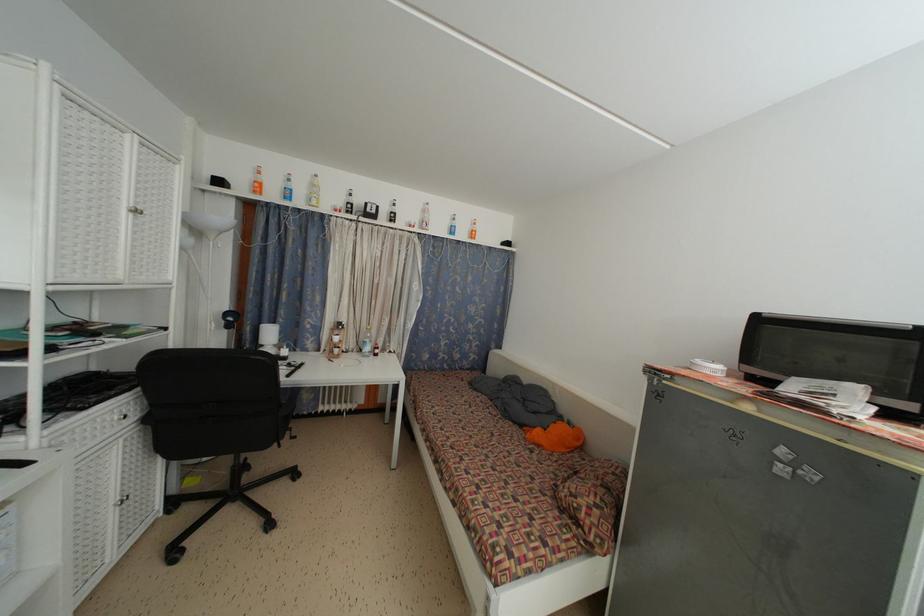
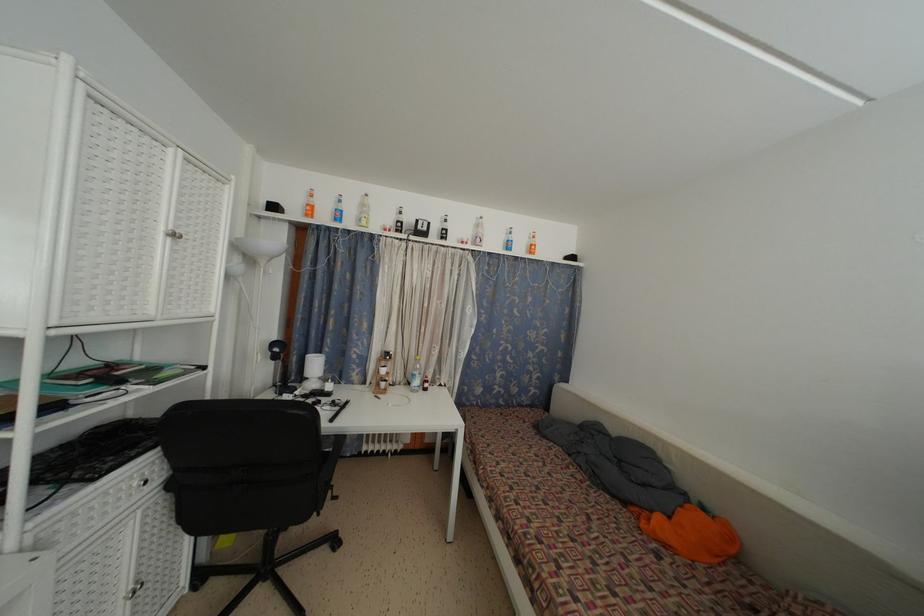
The point at (526, 431) is marked in the first image. Where is the corresponding point in the second image?

(629, 509)